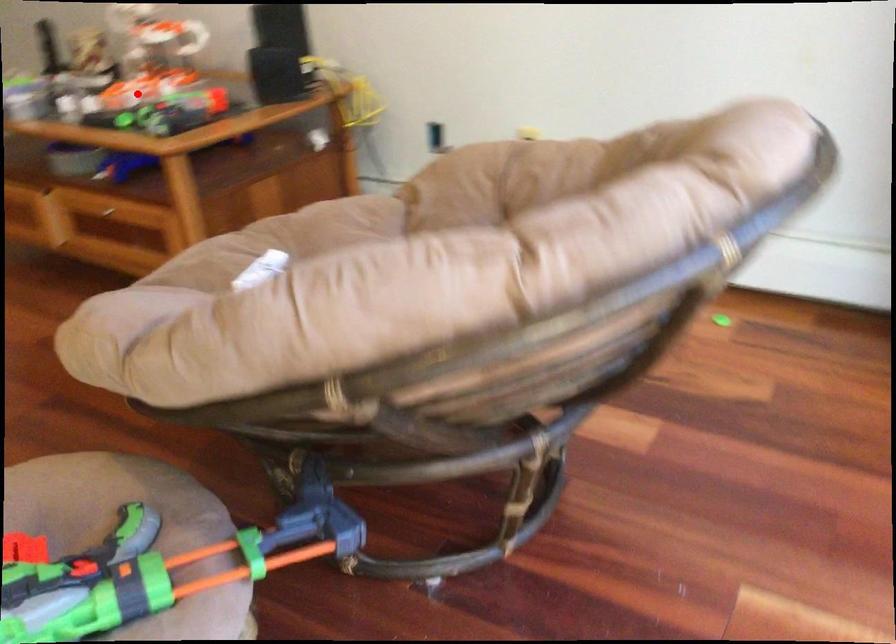
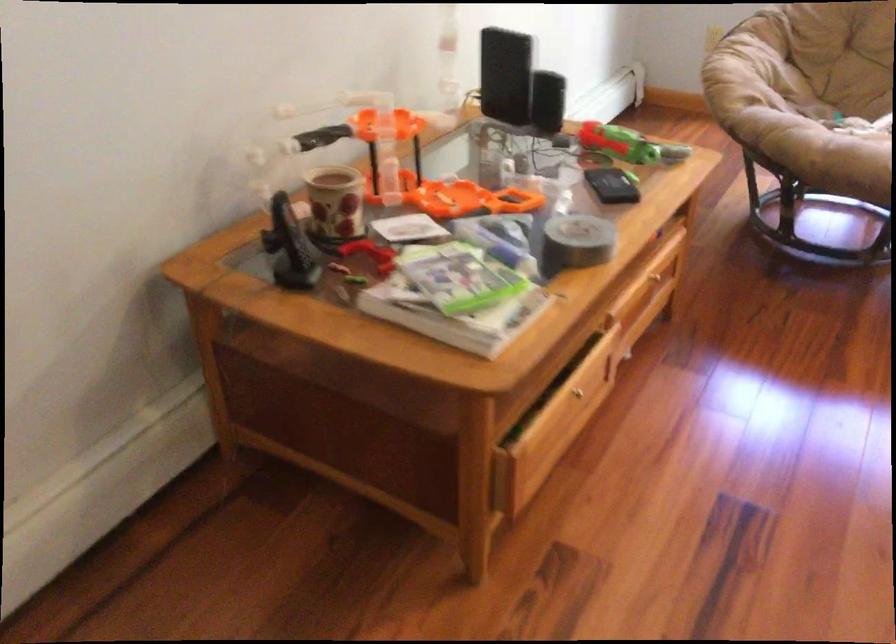
Question: I am providing you with two images of the same scene from different viewpoints. Image1 has a red point marked. In image2, the corresponding 3D location appears at what relative position? Reply with the corresponding letter.

Choices:
 (A) Closer
 (B) Farther

Answer: (A)